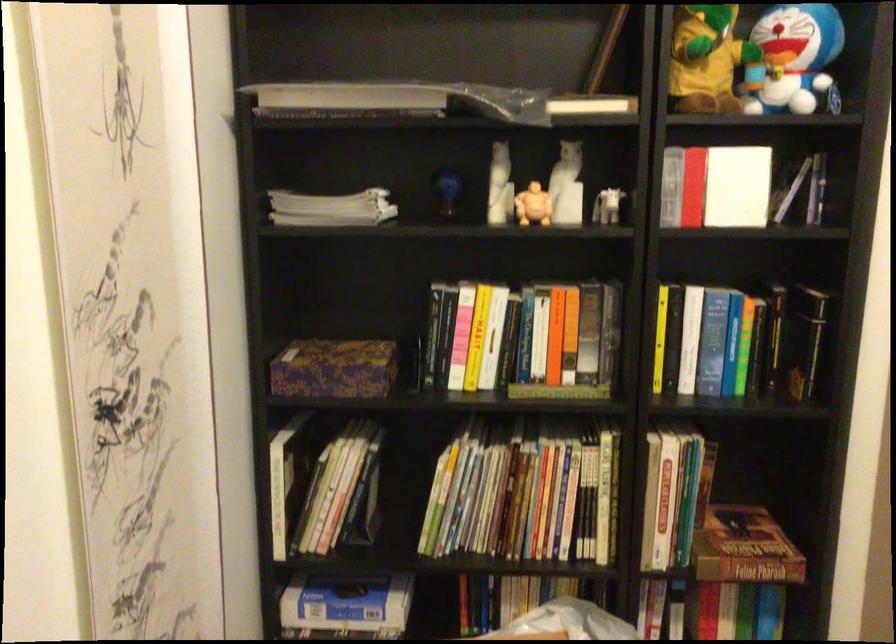
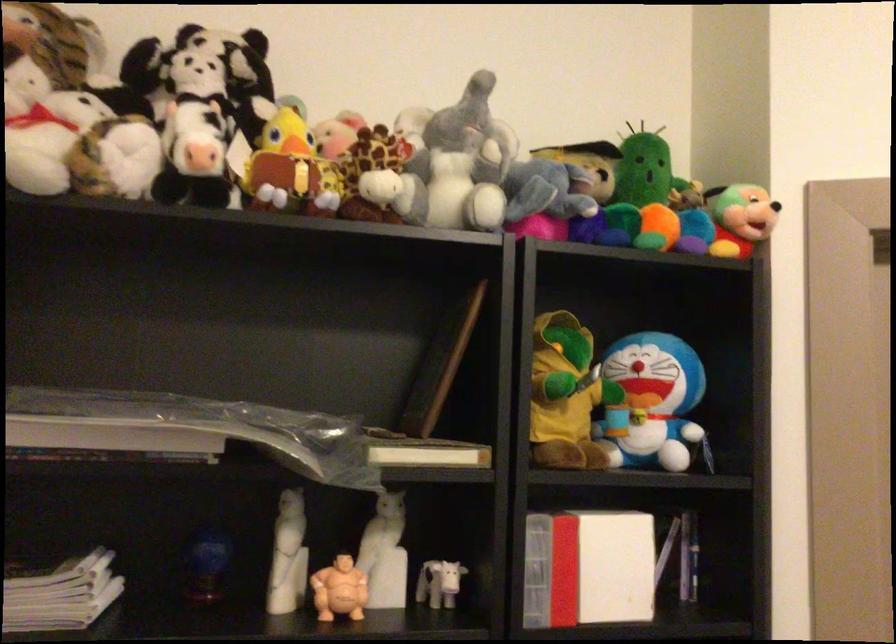
Locate, in the second image, the point that corresponds to point 531,204 in the first image.

(339, 589)